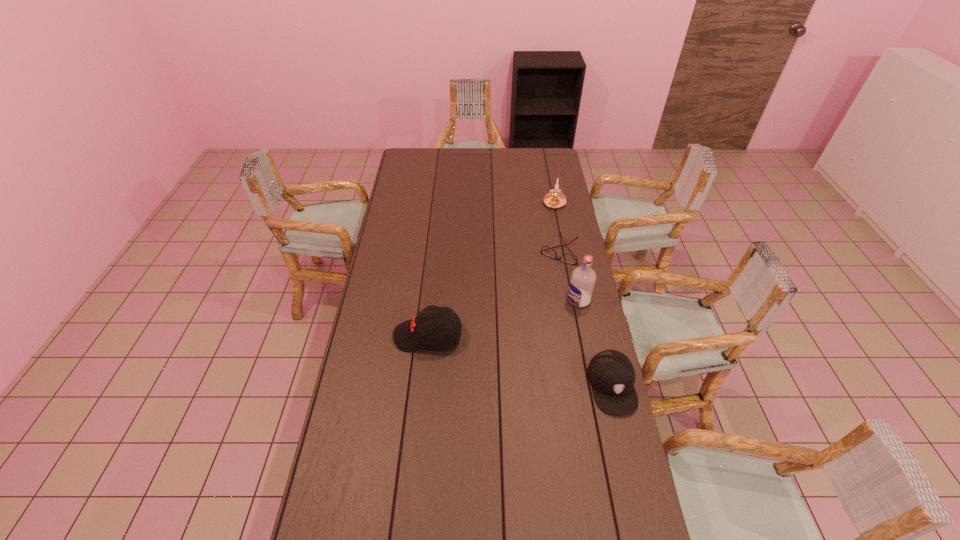
The width and height of the screenshot is (960, 540). Identify the location of free region at the right edge. (553, 310).

At what (x,y) coordinates should I click in order to perform the action: click on free space at the far left corner of the desktop. Please return your answer as a coordinate pair (x, y). The height and width of the screenshot is (540, 960). Looking at the image, I should click on (417, 150).

Where is `free space at the far right corner of the desktop`? The image size is (960, 540). free space at the far right corner of the desktop is located at coordinates (541, 155).

You are a GUI agent. You are given a task and a screenshot of the screen. Output one action in this format:
    pyautogui.click(x=<x>, y=<y>)
    Task: Click on the vacant point located between the shortest object and the baseball cap
    This screenshot has width=960, height=540.
    Given the screenshot: What is the action you would take?
    pyautogui.click(x=493, y=294)

Where is `free space between the third nearest object and the baseball cap`? This screenshot has height=540, width=960. free space between the third nearest object and the baseball cap is located at coordinates (503, 318).

This screenshot has height=540, width=960. In order to click on empty space between the cap and the leftmost object in this screenshot , I will do `click(520, 361)`.

The image size is (960, 540). I want to click on free space between the third farthest object and the baseball cap, so click(x=503, y=318).

Identify the location of vacant space that is in between the farthest object and the third farthest object. (566, 252).

This screenshot has height=540, width=960. In order to click on vacant space that's between the spectacles and the candle holder in this screenshot , I will do `click(557, 228)`.

You are a GUI agent. You are given a task and a screenshot of the screen. Output one action in this format:
    pyautogui.click(x=<x>, y=<y>)
    Task: Click on the vacant area between the third farthest object and the nearest object
    This screenshot has width=960, height=540.
    Given the screenshot: What is the action you would take?
    pyautogui.click(x=595, y=342)